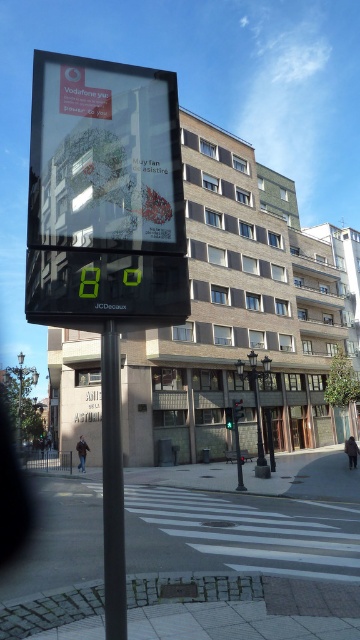
You are standing in the urban street scene and want to know which of the two points, point (65, 198) or point (101, 456), is closer to you. Based on the scene description, can you determine which one is nearer?

Point (65, 198) is closer to the viewer than point (101, 456).

You are a pedestrian standing on the sidewalk facing the transparent glass billboard at center and the black metal pole at center. Which object is closer to your left side?

The transparent glass billboard at center is closer to your left side because it is positioned to the left of the black metal pole at center.